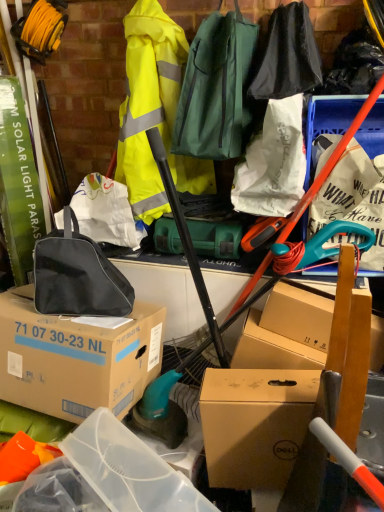
Question: Does brown cardboard box at center, which ranks as the first box in left-to-right order, contain black fabric bag at upper center, the 1th clothing positioned from the right?

Choices:
 (A) no
 (B) yes

Answer: (A)

Question: Can you confirm if brown cardboard box at center, arranged as the second box when viewed from the right, is bigger than black fabric bag at upper center, the 1th clothing positioned from the right?

Choices:
 (A) yes
 (B) no

Answer: (A)

Question: Is brown cardboard box at center, which ranks as the first box in left-to-right order, further to the viewer compared to black fabric bag at upper center, the 1th clothing positioned from the right?

Choices:
 (A) no
 (B) yes

Answer: (A)

Question: Does brown cardboard box at center, which ranks as the first box in left-to-right order, appear on the left side of black fabric bag at upper center, placed as the 3th clothing when sorted from left to right?

Choices:
 (A) yes
 (B) no

Answer: (A)

Question: From the image's perspective, is brown cardboard box at center, which ranks as the first box in left-to-right order, under black fabric bag at upper center, the 1th clothing positioned from the right?

Choices:
 (A) yes
 (B) no

Answer: (A)

Question: Considering the positions of point (281, 13) and point (235, 37), is point (281, 13) closer or farther from the camera than point (235, 37)?

Choices:
 (A) farther
 (B) closer

Answer: (A)

Question: From the image's perspective, is black fabric bag at upper center, placed as the 3th clothing when sorted from left to right, above or below green fabric bag at upper center, arranged as the 1th luggage and bags when viewed from the top?

Choices:
 (A) above
 (B) below

Answer: (A)

Question: Considering their positions, is black fabric bag at upper center, the 1th clothing positioned from the right, located in front of or behind green fabric bag at upper center, placed as the first luggage and bags when sorted from right to left?

Choices:
 (A) behind
 (B) front

Answer: (A)

Question: Is black fabric bag at upper center, the 1th clothing positioned from the right, taller or shorter than green fabric bag at upper center, placed as the 2th luggage and bags when sorted from bottom to top?

Choices:
 (A) short
 (B) tall

Answer: (A)

Question: Does point (160, 201) appear closer or farther from the camera than point (379, 164)?

Choices:
 (A) closer
 (B) farther

Answer: (B)

Question: Considering the positions of high-visibility yellow jacket at upper center, marked as the first clothing in a left-to-right arrangement, and white paper bag at upper right in the image, is high-visibility yellow jacket at upper center, marked as the first clothing in a left-to-right arrangement, taller or shorter than white paper bag at upper right?

Choices:
 (A) short
 (B) tall

Answer: (B)

Question: From the image's perspective, is high-visibility yellow jacket at upper center, arranged as the third clothing when viewed from the right, above or below white paper bag at upper right?

Choices:
 (A) above
 (B) below

Answer: (A)

Question: In the image, is high-visibility yellow jacket at upper center, arranged as the third clothing when viewed from the right, on the left side or the right side of white paper bag at upper right?

Choices:
 (A) right
 (B) left

Answer: (B)

Question: Considering the relative positions of white paper bag at upper center, which is the 2th clothing from right to left, and white paper bag at upper right in the image provided, is white paper bag at upper center, which is the 2th clothing from right to left, to the left or to the right of white paper bag at upper right?

Choices:
 (A) left
 (B) right

Answer: (A)

Question: In the image, is white paper bag at upper center, which is the 2th clothing from right to left, positioned in front of or behind white paper bag at upper right?

Choices:
 (A) front
 (B) behind

Answer: (A)